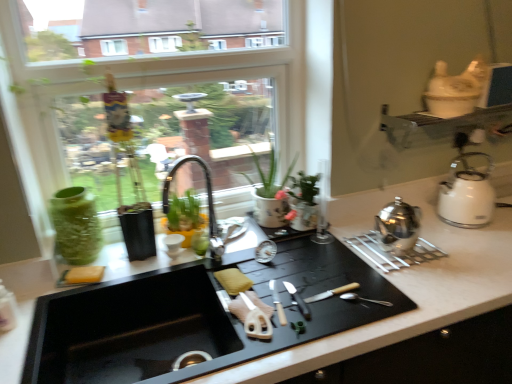
Find the location of `free space to the left of silver metallic knife at center, marked as the first knife in a right-to-left arrangement`. free space to the left of silver metallic knife at center, marked as the first knife in a right-to-left arrangement is located at coordinates (247, 292).